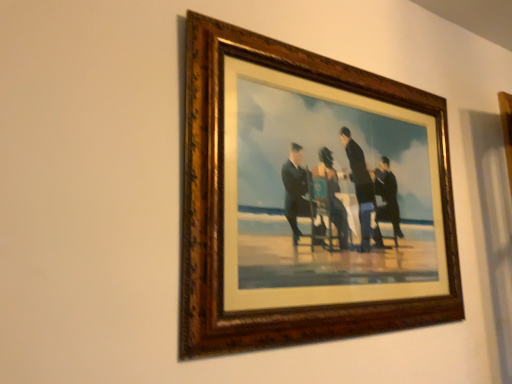
What do you see at coordinates (306, 198) in the screenshot?
I see `wooden picture frame at upper center` at bounding box center [306, 198].

At what (x,y) coordinates should I click in order to perform the action: click on wooden picture frame at upper center. Please return your answer as a coordinate pair (x, y). Looking at the image, I should click on (306, 198).

You are a GUI agent. You are given a task and a screenshot of the screen. Output one action in this format:
    pyautogui.click(x=<x>, y=<y>)
    Task: Click on the wooden picture frame at upper center
    Image resolution: width=512 pixels, height=384 pixels.
    Given the screenshot: What is the action you would take?
    [306, 198]